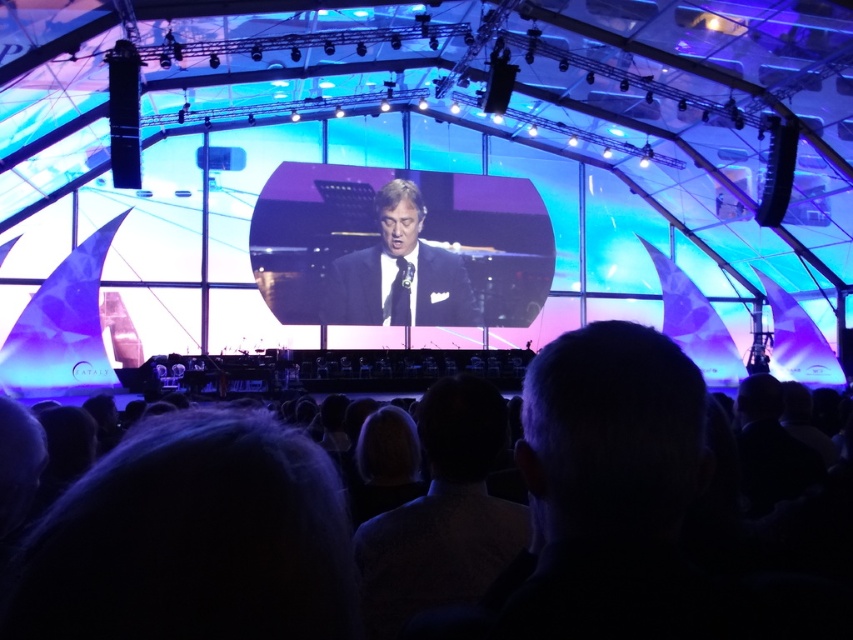
This screenshot has height=640, width=853. I want to click on black silk suit at center, so click(x=419, y=236).

Between black silk suit at center and matte black suit at center, which one is positioned higher?

Positioned higher is black silk suit at center.

Does point (355, 170) come closer to viewer compared to point (345, 308)?

No, (355, 170) is further to viewer.

Where is `black silk suit at center`? Image resolution: width=853 pixels, height=640 pixels. black silk suit at center is located at coordinates (419, 236).

Looking at this image, does dark hair at lower center have a larger size compared to black silk suit at center?

Actually, dark hair at lower center might be smaller than black silk suit at center.

Consider the image. Does dark hair at lower center appear on the left side of black silk suit at center?

Incorrect, dark hair at lower center is not on the left side of black silk suit at center.

Where is `dark hair at lower center`? Image resolution: width=853 pixels, height=640 pixels. dark hair at lower center is located at coordinates (189, 541).

Can you confirm if dark hair at lower center is wider than matte black suit at center?

Correct, the width of dark hair at lower center exceeds that of matte black suit at center.

Does dark hair at lower center appear on the left side of matte black suit at center?

Yes, dark hair at lower center is to the left of matte black suit at center.

The image size is (853, 640). What do you see at coordinates (189, 541) in the screenshot?
I see `dark hair at lower center` at bounding box center [189, 541].

Locate an element on the screen. dark hair at lower center is located at coordinates (189, 541).